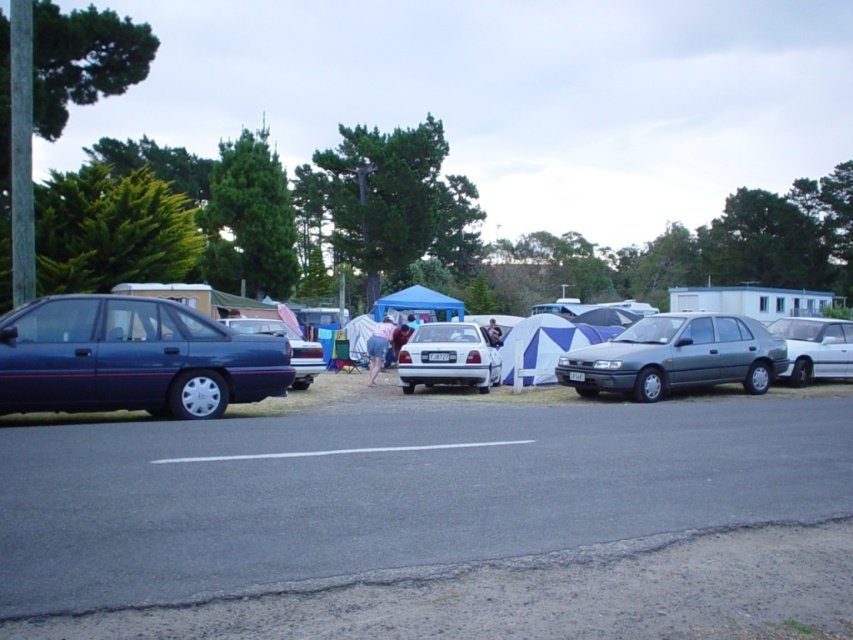
You are standing at the center of the road and want to find the satin white sedan at center. According to the coordinates, where should you look relative to your position?

The satin white sedan at center is located at coordinates point (448, 356), which is slightly to the right and forward from your position at the center of the road.

You are driving a car and want to exit the road where the satin silver sedan at center and the satin white sedan at center are parked. Which car should you move first to clear the path?

The satin silver sedan at center is in front of the satin white sedan at center, so you should move the satin silver sedan at center first to clear the path.